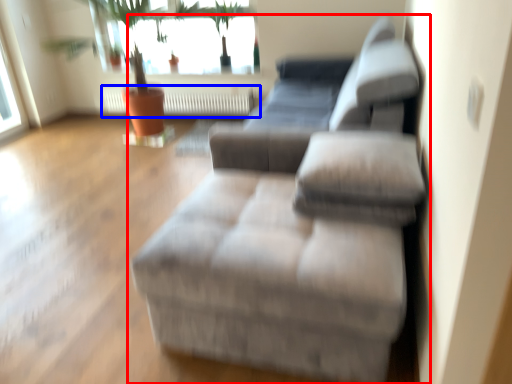
Question: Which point is closer to the camera, studio couch (highlighted by a red box) or radiator (highlighted by a blue box)?

Choices:
 (A) studio couch
 (B) radiator

Answer: (A)